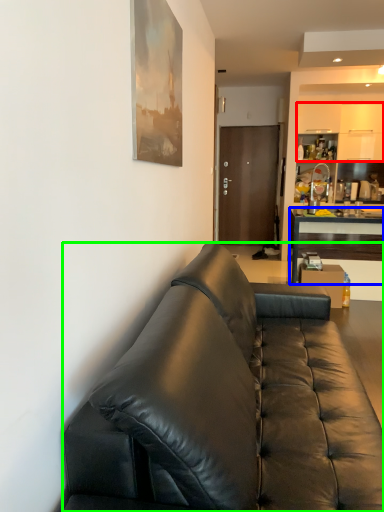
Question: Based on their relative distances, which object is farther from cabinetry (highlighted by a red box)? Choose from desk (highlighted by a blue box) and studio couch (highlighted by a green box).

Choices:
 (A) desk
 (B) studio couch

Answer: (B)